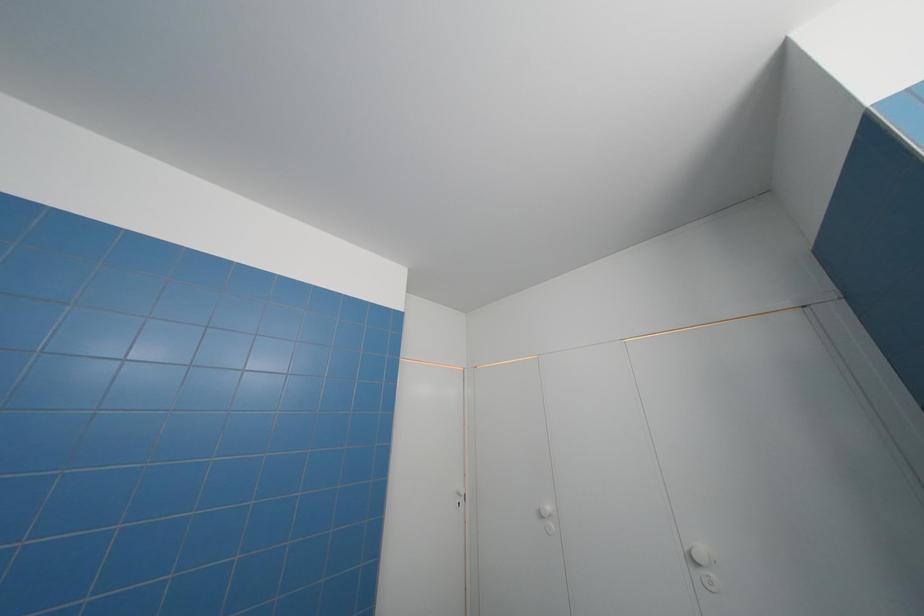
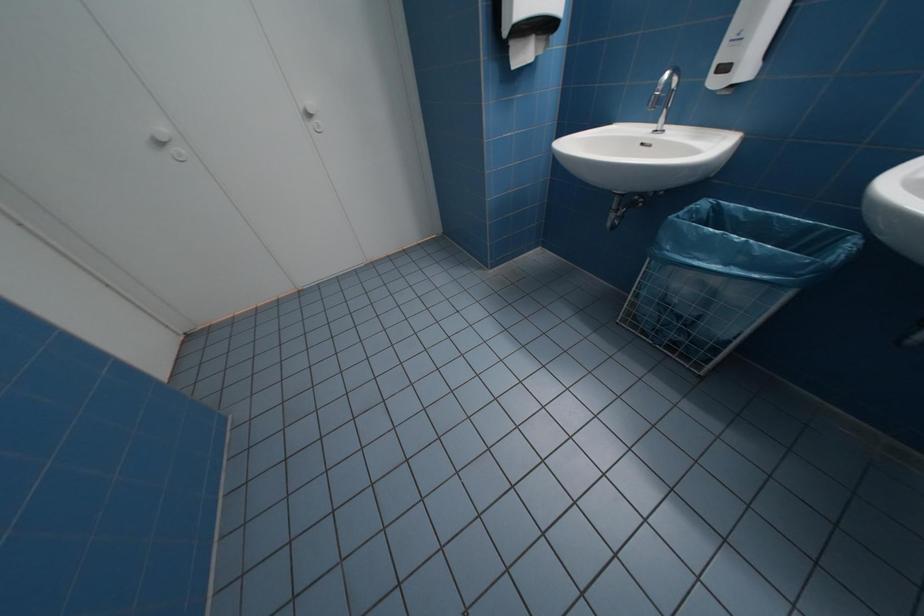
Consider the image. The images are taken continuously from a first-person perspective. In which direction is your viewpoint rotating?

The camera's rotation is toward right-down.